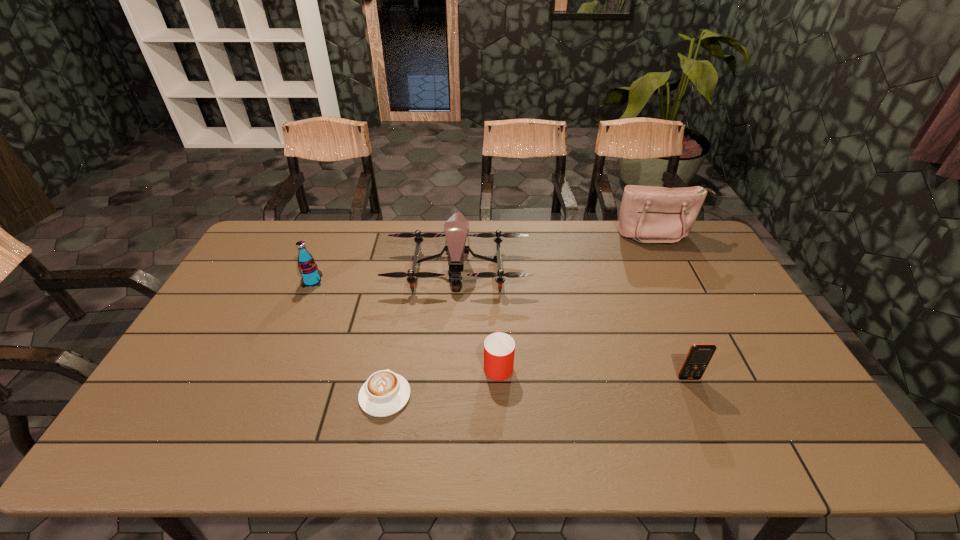
Locate an element on the screen. This screenshot has height=540, width=960. free space at the far edge is located at coordinates tap(510, 220).

Locate an element on the screen. The height and width of the screenshot is (540, 960). free space at the near edge is located at coordinates (331, 441).

Where is `vacant space at the left edge`? The width and height of the screenshot is (960, 540). vacant space at the left edge is located at coordinates (176, 375).

In the image, there is a desktop. Identify the location of free space at the right edge. (790, 398).

In the image, there is a desktop. Where is `blank space at the far left corner`? The image size is (960, 540). blank space at the far left corner is located at coordinates (270, 224).

Image resolution: width=960 pixels, height=540 pixels. Find the location of `vacant area at the near left corner of the desktop`. vacant area at the near left corner of the desktop is located at coordinates (156, 443).

Image resolution: width=960 pixels, height=540 pixels. In order to click on vacant space at the far right corner of the desktop in this screenshot , I will do `click(715, 260)`.

You are a GUI agent. You are given a task and a screenshot of the screen. Output one action in this format:
    pyautogui.click(x=<x>, y=<y>)
    Task: Click on the vacant area that lies between the cappuccino and the cellular telephone
    
    Given the screenshot: What is the action you would take?
    pyautogui.click(x=537, y=387)

Image resolution: width=960 pixels, height=540 pixels. In order to click on free space that is in between the soda and the shortest object in this screenshot , I will do `click(348, 339)`.

Locate an element on the screen. free area in between the drone and the cappuccino is located at coordinates (421, 332).